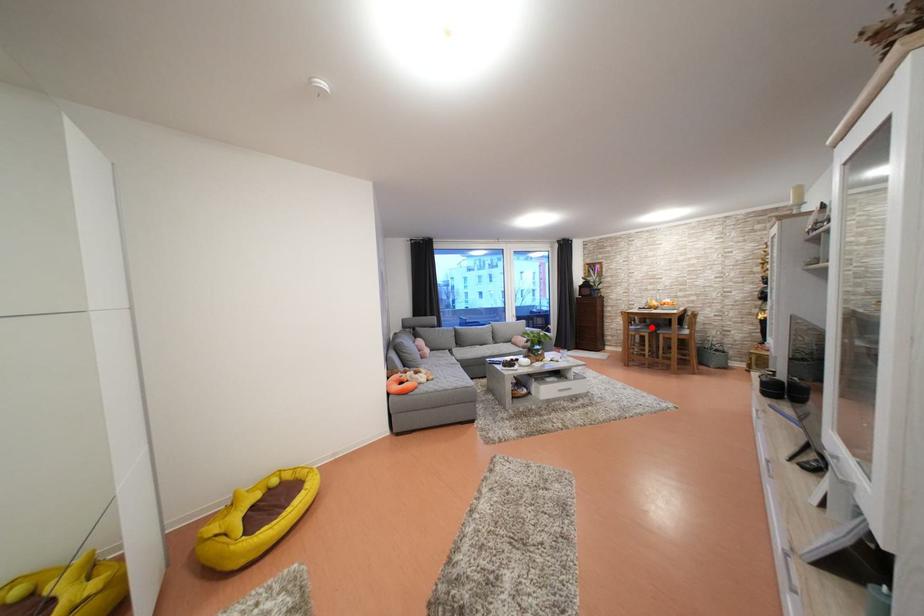
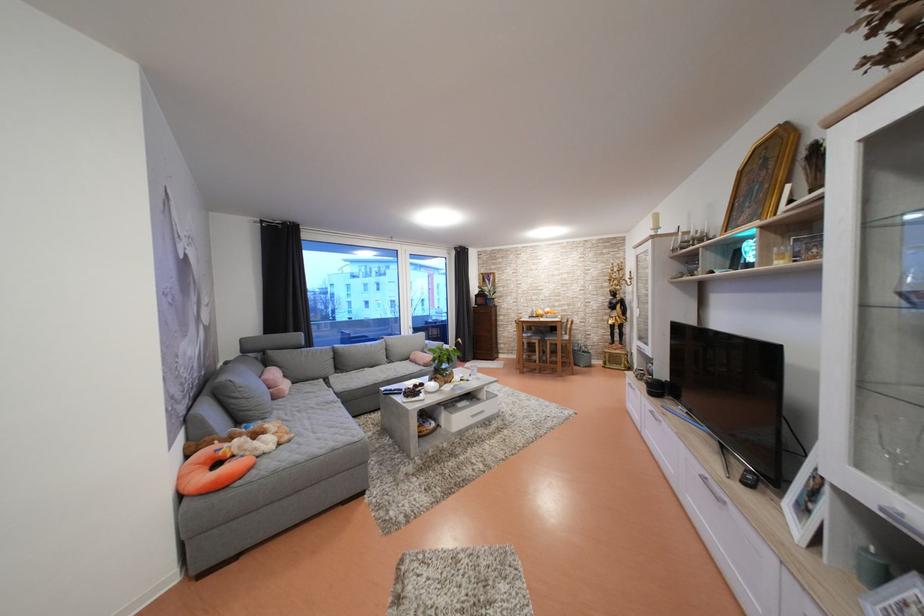
Find the pixel in the second image that matches the highlighted location in the first image.

(538, 334)